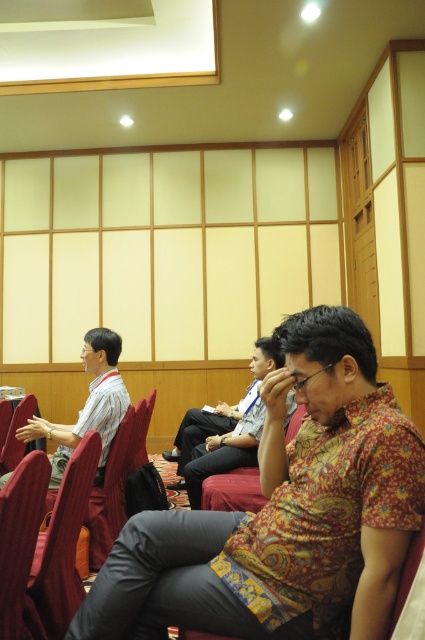
Looking at this image, between batik shirt at center and patterned fabric shirt at center, which one has less height?

Standing shorter between the two is batik shirt at center.

Based on the photo, is batik shirt at center bigger than patterned fabric shirt at center?

No.

Does point (325, 580) lie in front of point (212, 449)?

Yes.

The width and height of the screenshot is (425, 640). Identify the location of batik shirt at center. (283, 513).

Is batik shirt at center closer to the viewer compared to red fabric chair at lower left?

Yes, batik shirt at center is closer to the viewer.

The width and height of the screenshot is (425, 640). Identify the location of batik shirt at center. (283, 513).

Image resolution: width=425 pixels, height=640 pixels. What do you see at coordinates (283, 513) in the screenshot?
I see `batik shirt at center` at bounding box center [283, 513].

You are a GUI agent. You are given a task and a screenshot of the screen. Output one action in this format:
    pyautogui.click(x=<x>, y=<y>)
    Task: Click on the batik shirt at center
    Image resolution: width=425 pixels, height=640 pixels.
    Given the screenshot: What is the action you would take?
    pyautogui.click(x=283, y=513)

In the scene shown: Does patterned fabric shirt at center have a smaller size compared to matte white shirt at left?

No.

Between patterned fabric shirt at center and matte white shirt at left, which one appears on the right side from the viewer's perspective?

From the viewer's perspective, patterned fabric shirt at center appears more on the right side.

Is point (223, 429) behind point (79, 410)?

No, (223, 429) is closer to viewer.

What are the coordinates of `patterned fabric shirt at center` in the screenshot? It's located at (226, 429).